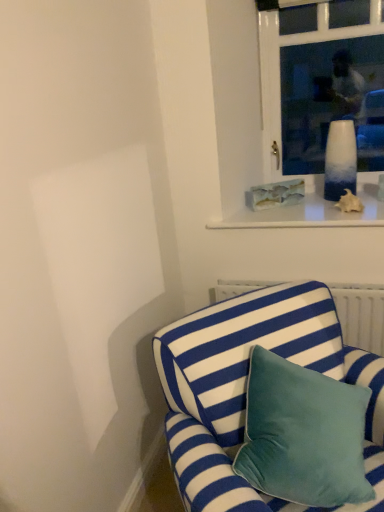
Question: Are blue and white striped fabric couch at lower right and translucent glass vase at upper right far apart?

Choices:
 (A) yes
 (B) no

Answer: (A)

Question: Is blue and white striped fabric couch at lower right bigger than translucent glass vase at upper right?

Choices:
 (A) no
 (B) yes

Answer: (B)

Question: Is blue and white striped fabric couch at lower right oriented towards translucent glass vase at upper right?

Choices:
 (A) no
 (B) yes

Answer: (A)

Question: Considering the relative sizes of blue and white striped fabric couch at lower right and translucent glass vase at upper right in the image provided, is blue and white striped fabric couch at lower right smaller than translucent glass vase at upper right?

Choices:
 (A) yes
 (B) no

Answer: (B)

Question: Considering the relative sizes of blue and white striped fabric couch at lower right and translucent glass vase at upper right in the image provided, is blue and white striped fabric couch at lower right wider than translucent glass vase at upper right?

Choices:
 (A) yes
 (B) no

Answer: (A)

Question: From the image's perspective, is translucent glass vase at upper right above or below white glass vase at upper center?

Choices:
 (A) below
 (B) above

Answer: (A)

Question: Is translucent glass vase at upper right in front of or behind white glass vase at upper center in the image?

Choices:
 (A) front
 (B) behind

Answer: (B)

Question: From a real-world perspective, relative to white glass vase at upper center, is translucent glass vase at upper right vertically above or below?

Choices:
 (A) below
 (B) above

Answer: (A)

Question: In terms of height, does translucent glass vase at upper right look taller or shorter compared to white glass vase at upper center?

Choices:
 (A) short
 (B) tall

Answer: (A)

Question: Looking at the image, does white glass vase at upper center seem bigger or smaller compared to blue and white striped fabric couch at lower right?

Choices:
 (A) big
 (B) small

Answer: (B)

Question: Is point (299, 34) closer or farther from the camera than point (203, 355)?

Choices:
 (A) farther
 (B) closer

Answer: (A)

Question: Is white glass vase at upper center in front of or behind blue and white striped fabric couch at lower right in the image?

Choices:
 (A) behind
 (B) front

Answer: (A)

Question: Is white glass vase at upper center situated inside blue and white striped fabric couch at lower right or outside?

Choices:
 (A) inside
 (B) outside

Answer: (B)

Question: Based on their sizes in the image, would you say white glass vase at upper center is bigger or smaller than translucent glass vase at upper right?

Choices:
 (A) small
 (B) big

Answer: (B)

Question: From the image's perspective, is white glass vase at upper center positioned above or below translucent glass vase at upper right?

Choices:
 (A) above
 (B) below

Answer: (A)